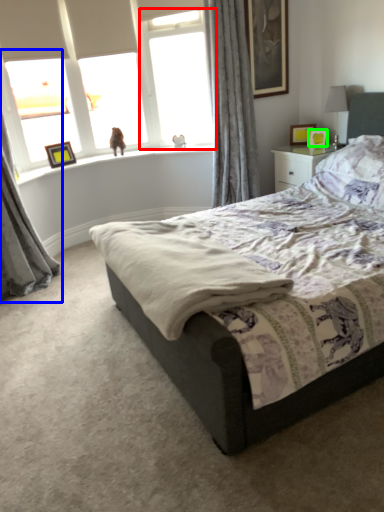
Question: Which object is the closest to the window screen (highlighted by a red box)? Choose among these: curtain (highlighted by a blue box) or picture frame (highlighted by a green box).

Choices:
 (A) curtain
 (B) picture frame

Answer: (B)